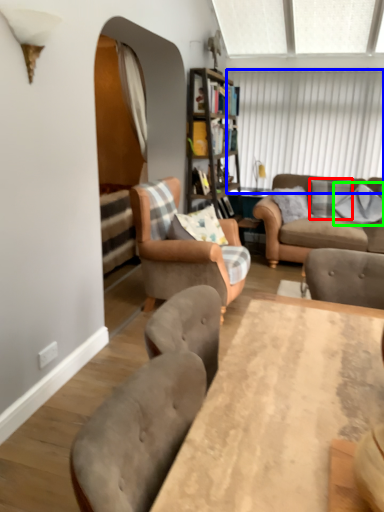
Question: Which object is positioned closest to pillow (highlighted by a red box)? Select from window screen (highlighted by a blue box) and pillow (highlighted by a green box).

Choices:
 (A) window screen
 (B) pillow

Answer: (B)